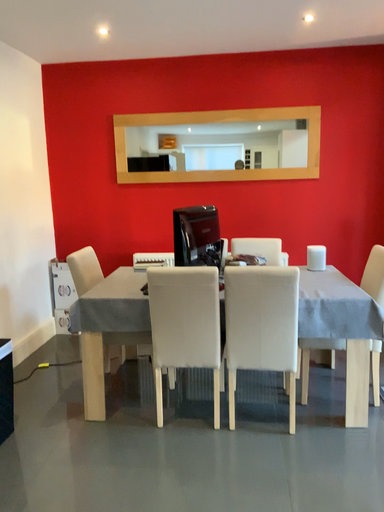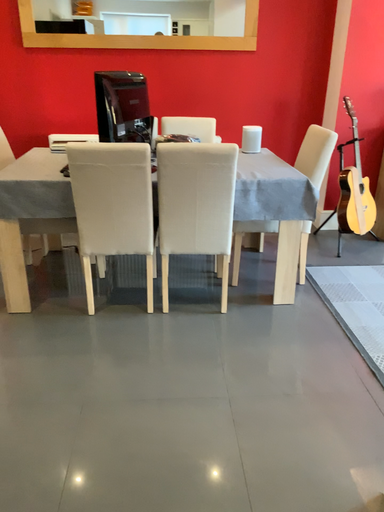
Question: How did the camera likely rotate when shooting the video?

Choices:
 (A) rotated left
 (B) rotated right

Answer: (B)